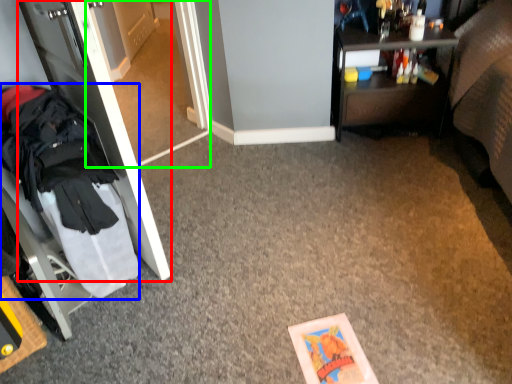
Question: Considering the real-world distances, which object is closest to door (highlighted by a red box)? clothing (highlighted by a blue box) or glass door (highlighted by a green box).

Choices:
 (A) clothing
 (B) glass door

Answer: (A)